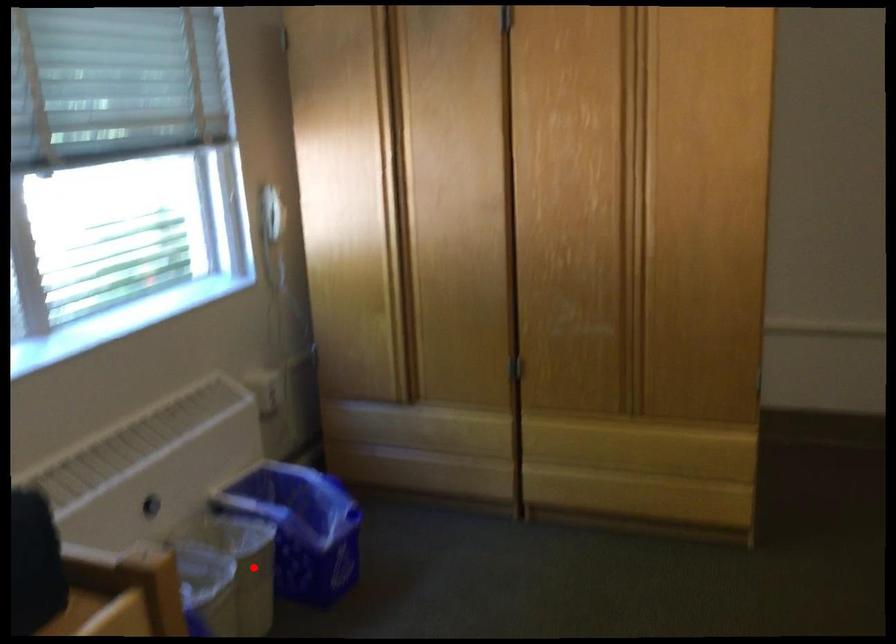
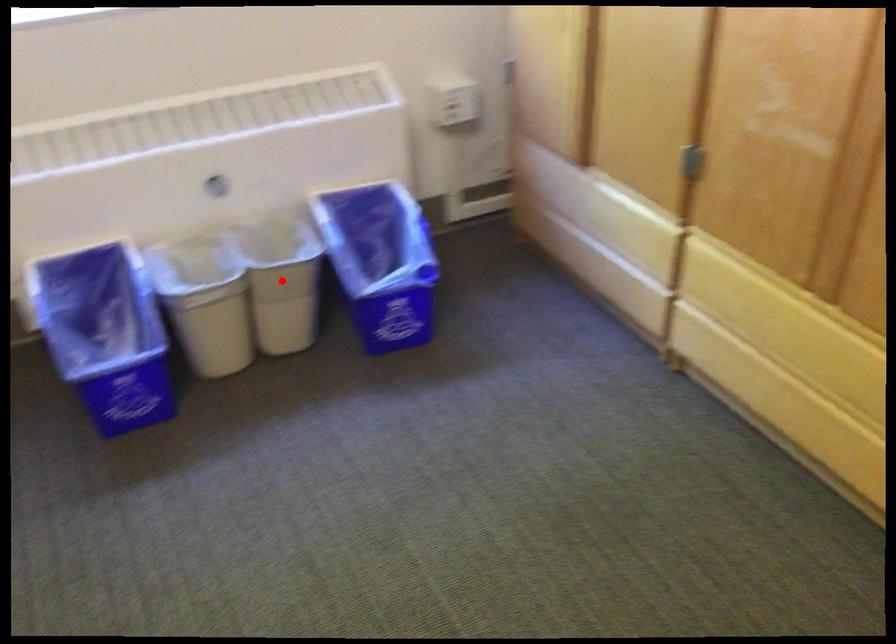
I am providing you with two images of the same scene from different viewpoints. A red point is marked on the first image and another point is marked on the second image. Is the marked point in image1 the same physical position as the marked point in image2?

Yes